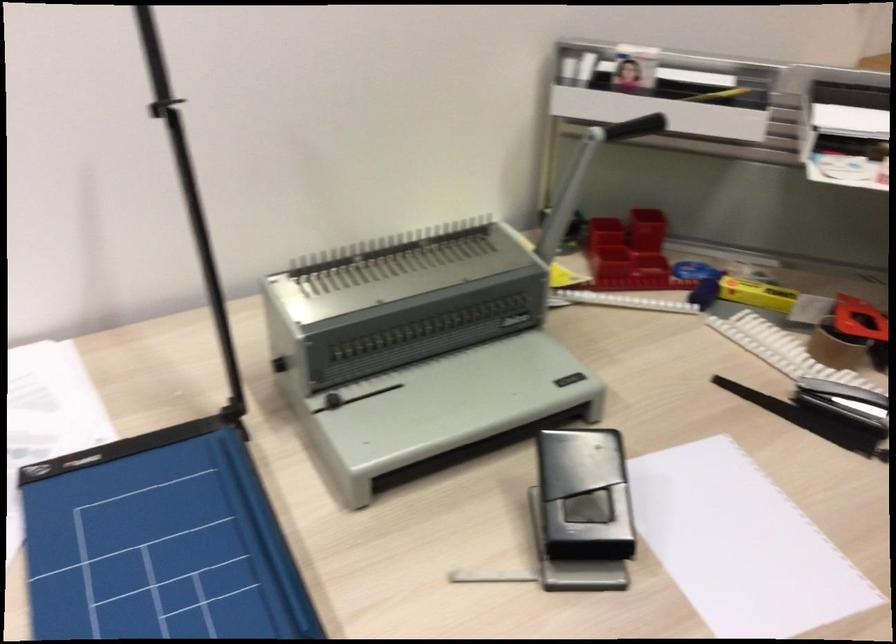
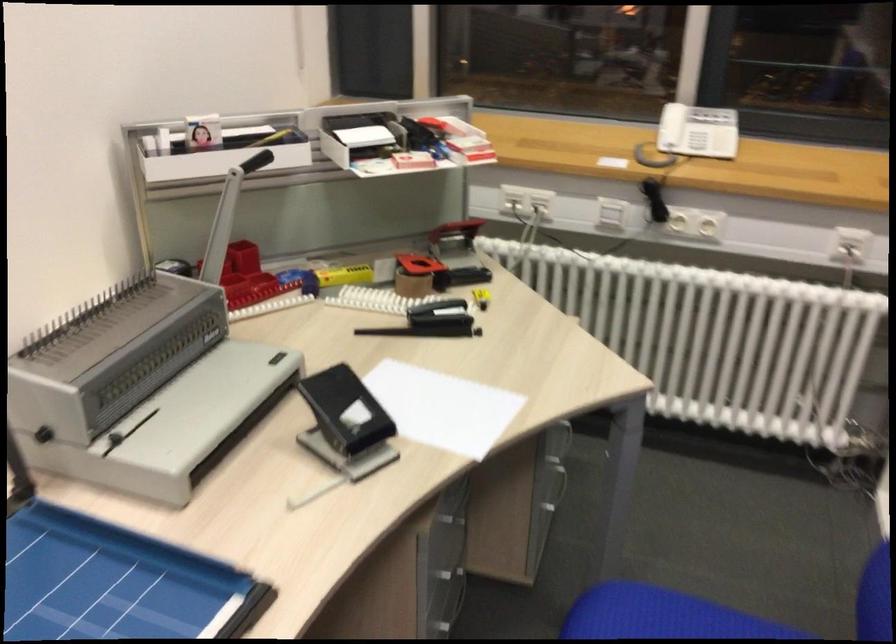
Locate, in the second image, the point that corresponds to [811,397] in the first image.

(431, 321)